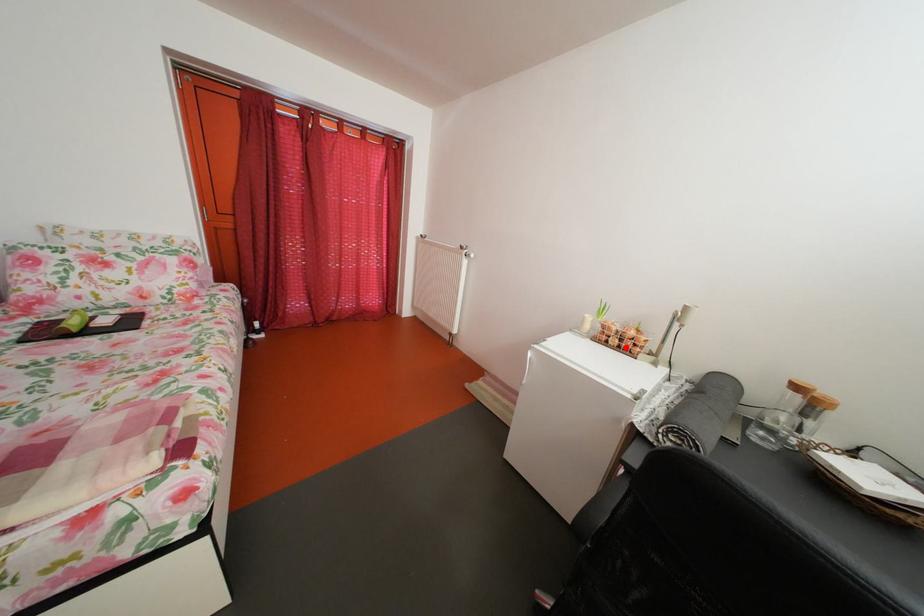
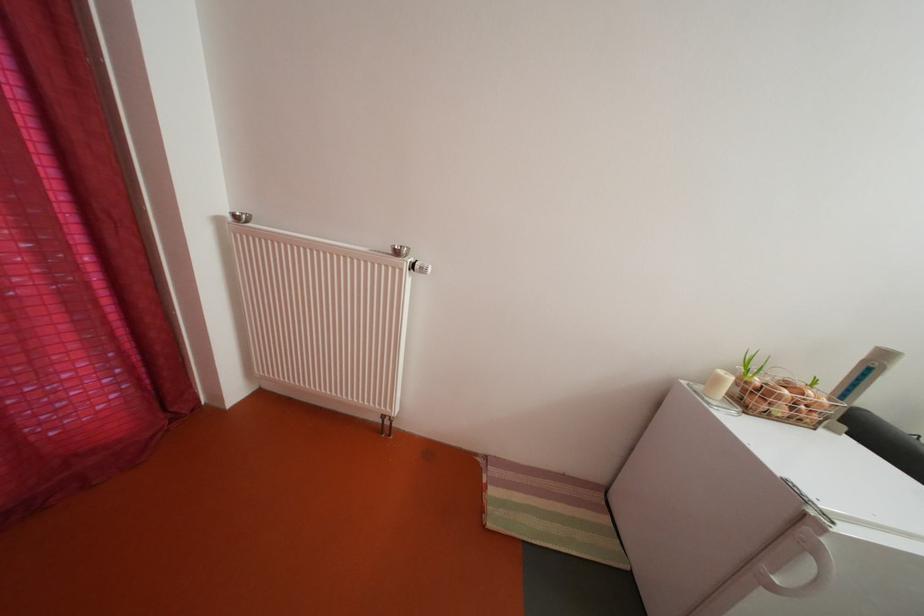
Where in the second image is the point corresponding to the highlighted location from the first image?

(792, 416)